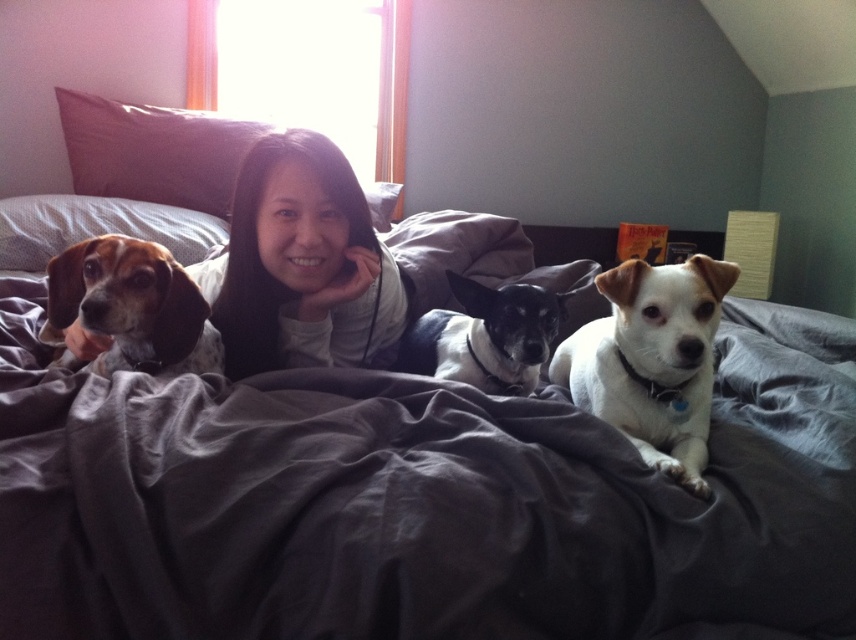
You are a photographer trying to capture a closeup of the gray fabric bed at center while also including the white fur dog at center in the frame. Can you focus on both objects simultaneously?

The gray fabric bed at center is closer to the viewer than the white fur dog at center, so focusing on both might be challenging unless you adjust your camera settings for a wider depth of field.

You are a photographer taking a picture of the smooth skin at center and the white fur dog at center. Which one has a larger width in the image?

The smooth skin at center might be wider than white fur dog at center according to the description.